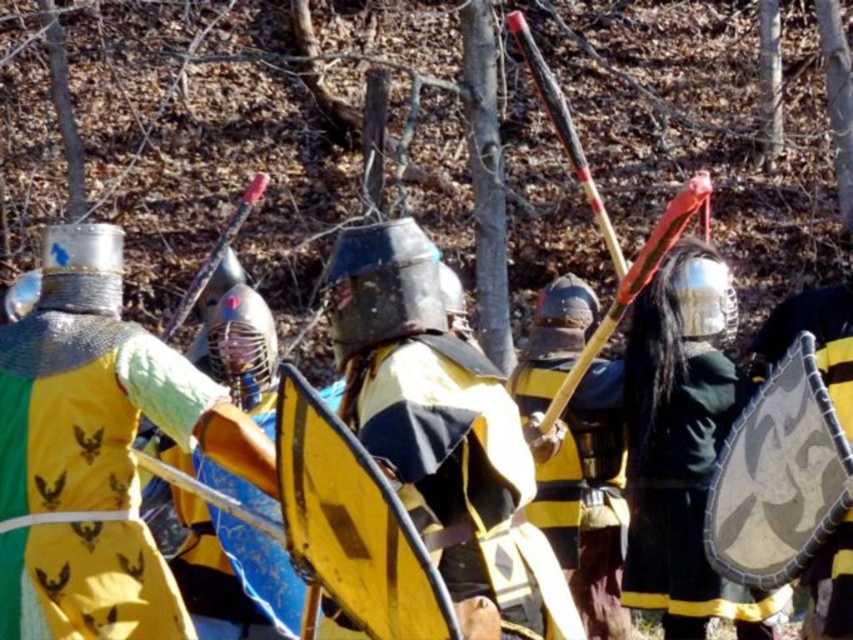
Does yellow fabric shield at center have a greater height compared to yellow and black armor at center?

Yes.

Looking at this image, does yellow fabric shield at center have a lesser height compared to yellow and black armor at center?

In fact, yellow fabric shield at center may be taller than yellow and black armor at center.

Who is more forward, (88, 449) or (393, 480)?

Point (393, 480) is more forward.

Find the location of a particular element. yellow fabric shield at center is located at coordinates (x=96, y=451).

Measure the distance between shiny silver helmet at center and black leather shield at right.

The distance of shiny silver helmet at center from black leather shield at right is 1.82 meters.

Can you confirm if shiny silver helmet at center is taller than black leather shield at right?

In fact, shiny silver helmet at center may be shorter than black leather shield at right.

In order to click on shiny silver helmet at center in this screenshot , I will do `click(682, 445)`.

Find the location of a particular element. shiny silver helmet at center is located at coordinates [682, 445].

Based on the photo, how much distance is there between yellow and black armor at center and black leather shield at right?

16.05 feet

Is point (473, 387) in front of point (828, 392)?

Yes, point (473, 387) is closer to viewer.

What do you see at coordinates (444, 429) in the screenshot? This screenshot has width=853, height=640. I see `yellow and black armor at center` at bounding box center [444, 429].

The width and height of the screenshot is (853, 640). I want to click on yellow and black armor at center, so click(x=444, y=429).